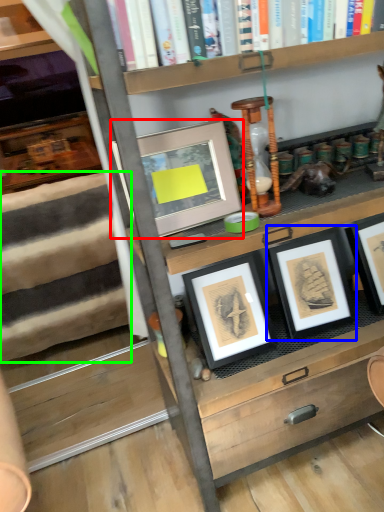
Question: Considering the real-world distances, which object is farthest from picture frame (highlighted by a red box)? picture frame (highlighted by a blue box) or stair (highlighted by a green box)?

Choices:
 (A) picture frame
 (B) stair

Answer: (B)